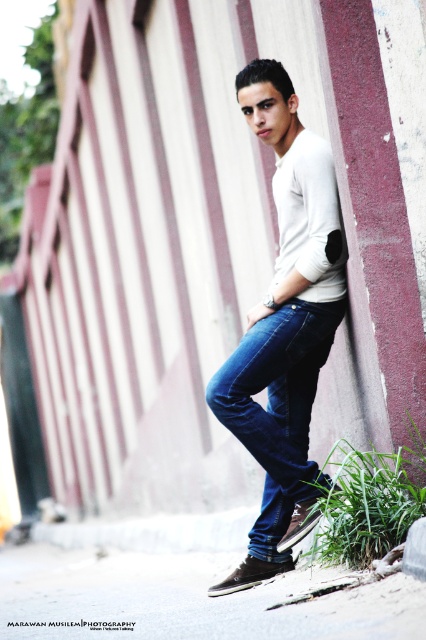
Who is lower down, matte white sweater at center or dark blue denim jeans at lower center?

dark blue denim jeans at lower center is below.

Which is behind, point (293, 424) or point (307, 381)?

The point (293, 424) is more distant.

Is point (307, 426) less distant than point (267, 483)?

Yes.

This screenshot has height=640, width=426. What are the coordinates of `matte white sweater at center` in the screenshot? It's located at (284, 328).